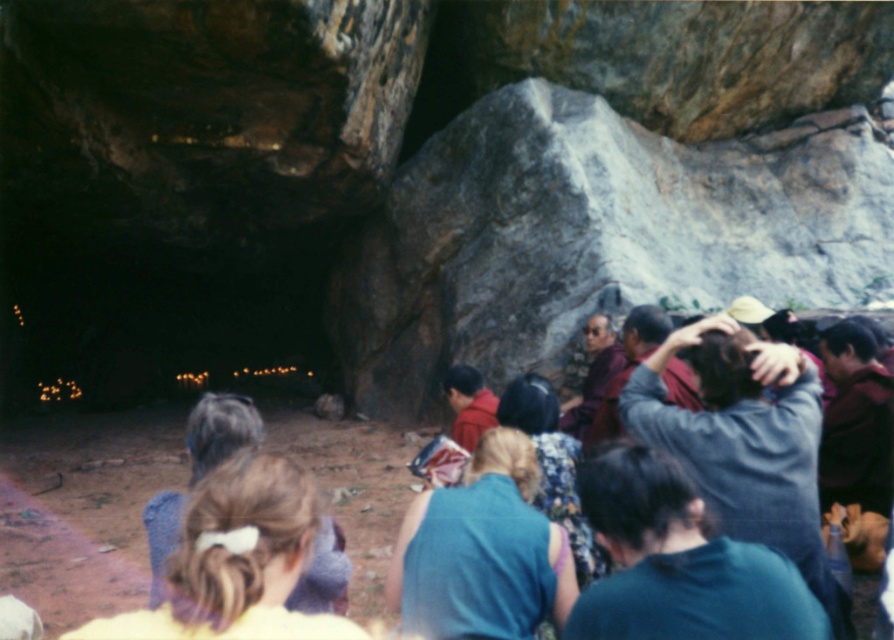
You are a photographer trying to capture a group photo of the maroon velvet robe at right and the floral fabric dress at center. If you want to ensure both are fully visible in the frame, which object should you position closer to the camera to avoid cropping?

You should position the maroon velvet robe at right closer to the camera because it might be wider than the floral fabric dress at center, ensuring both fit within the frame without cropping.